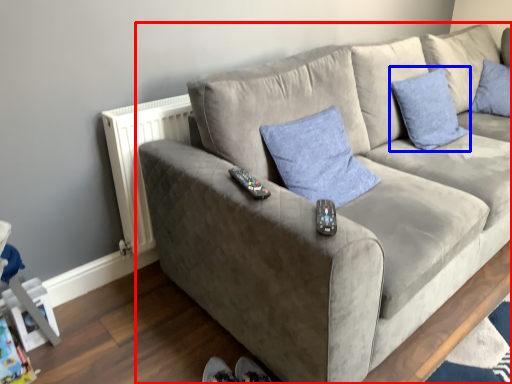
Question: Among these objects, which one is nearest to the camera, studio couch (highlighted by a red box) or pillow (highlighted by a blue box)?

Choices:
 (A) studio couch
 (B) pillow

Answer: (A)